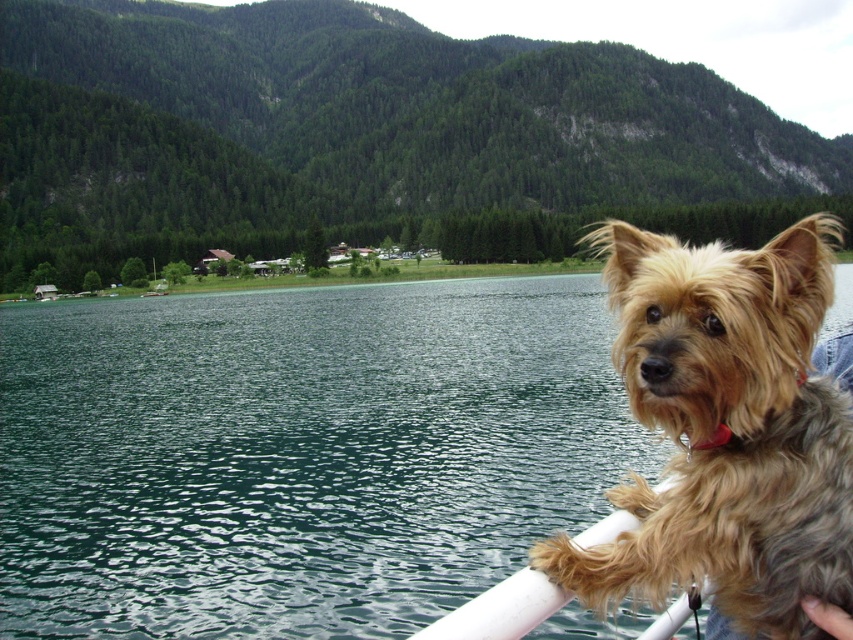
You are a photographer trying to capture the golden fur dog at right and the green water at lower left in the same frame. Which object will occupy more space in your photo?

The green water at lower left will occupy more space in the photo because it is bigger than the golden fur dog at right.

You are standing at the lakeside and want to take a photo of the golden fur dog at right. To avoid the green water at lower left from being in the background, should you move closer to or farther away from the dog?

The green water at lower left is further to the viewer than golden fur dog at right. To avoid the green water at lower left from being in the background, you should move closer to the golden fur dog at right so that the dog is in focus and the water is out of frame.